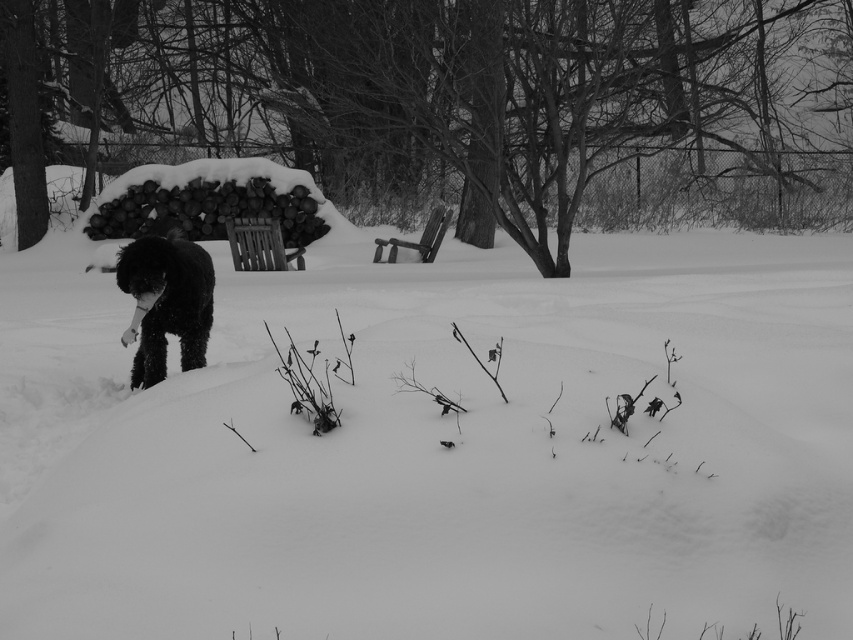
The width and height of the screenshot is (853, 640). What do you see at coordinates (436, 445) in the screenshot?
I see `white fluffy snow at center` at bounding box center [436, 445].

Who is lower down, white fluffy snow at center or black fluffy dog at left?

Positioned lower is black fluffy dog at left.

Does point (813, 632) come behind point (201, 289)?

No, it is not.

The height and width of the screenshot is (640, 853). I want to click on white fluffy snow at center, so click(436, 445).